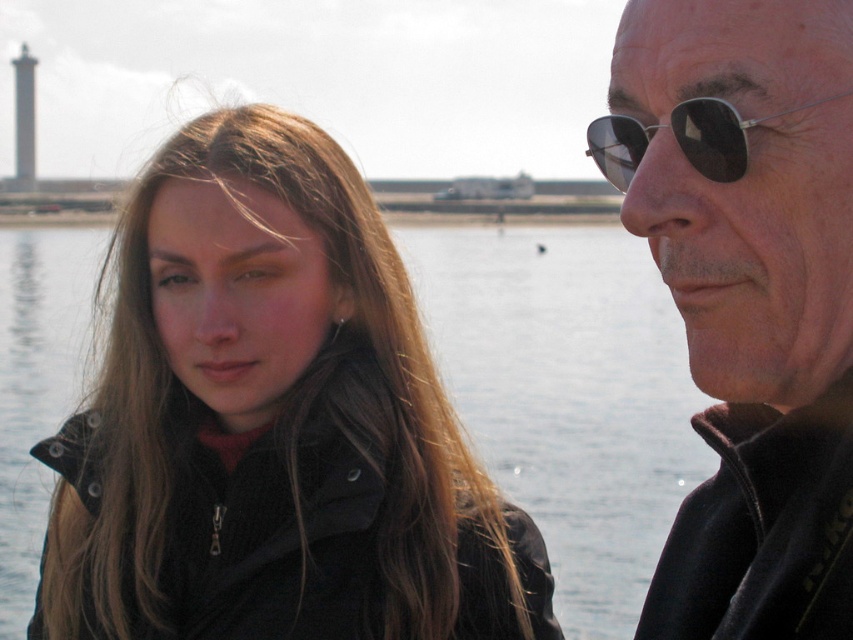
Question: Does black matte sunglasses at upper right have a greater width compared to sunglasses at right?

Choices:
 (A) no
 (B) yes

Answer: (B)

Question: Which of the following is the closest to the observer?

Choices:
 (A) (705, 433)
 (B) (289, 554)
 (C) (714, 150)

Answer: (C)

Question: Does matte black jacket at left have a lesser width compared to sunglasses at right?

Choices:
 (A) yes
 (B) no

Answer: (B)

Question: Which point appears farthest from the camera in this image?

Choices:
 (A) (289, 628)
 (B) (711, 131)
 (C) (718, 148)

Answer: (A)

Question: Which point is farther to the camera?

Choices:
 (A) (117, 490)
 (B) (704, 163)

Answer: (A)

Question: Does matte black jacket at left have a lesser width compared to black matte sunglasses at upper right?

Choices:
 (A) yes
 (B) no

Answer: (B)